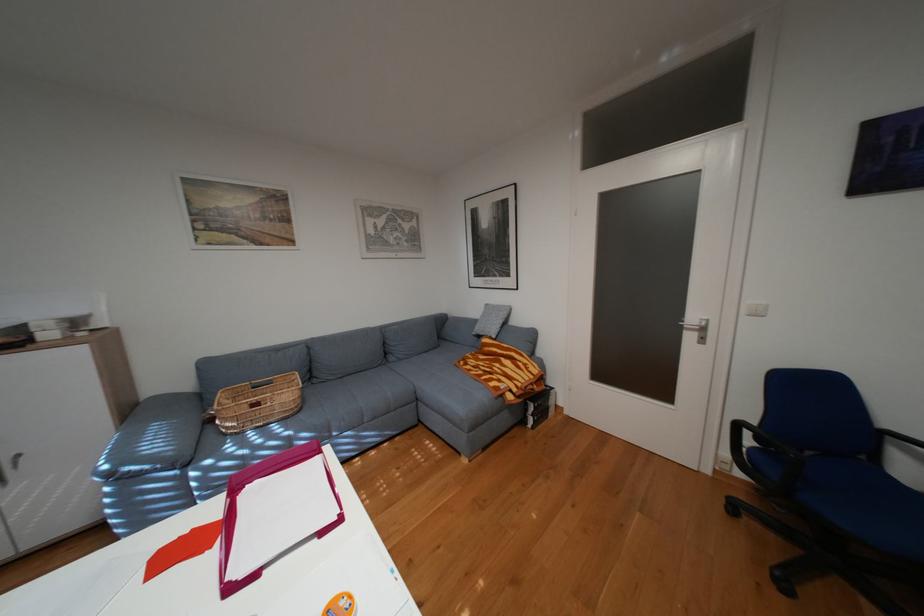
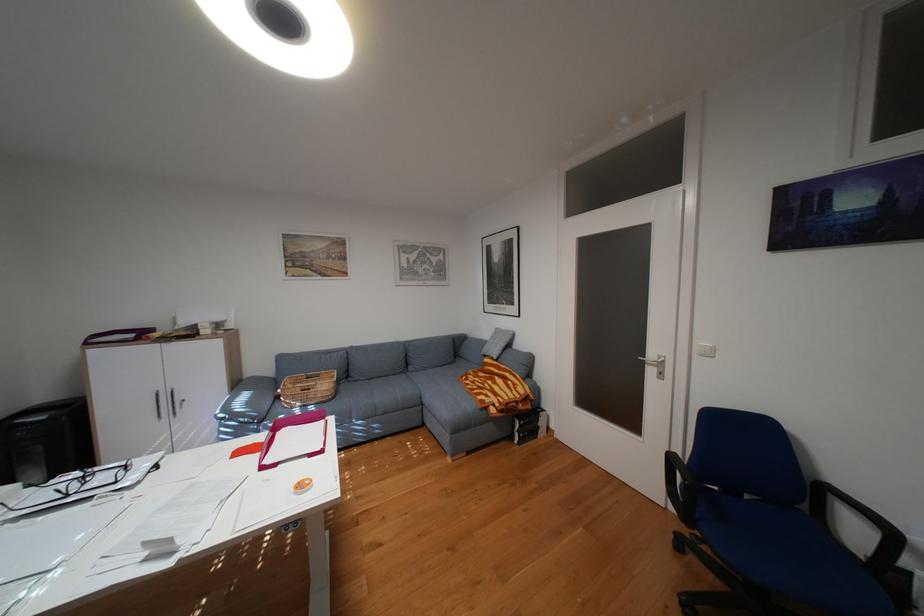
Where in the second image is the point corresponding to (283,382) from the first image?

(331, 375)